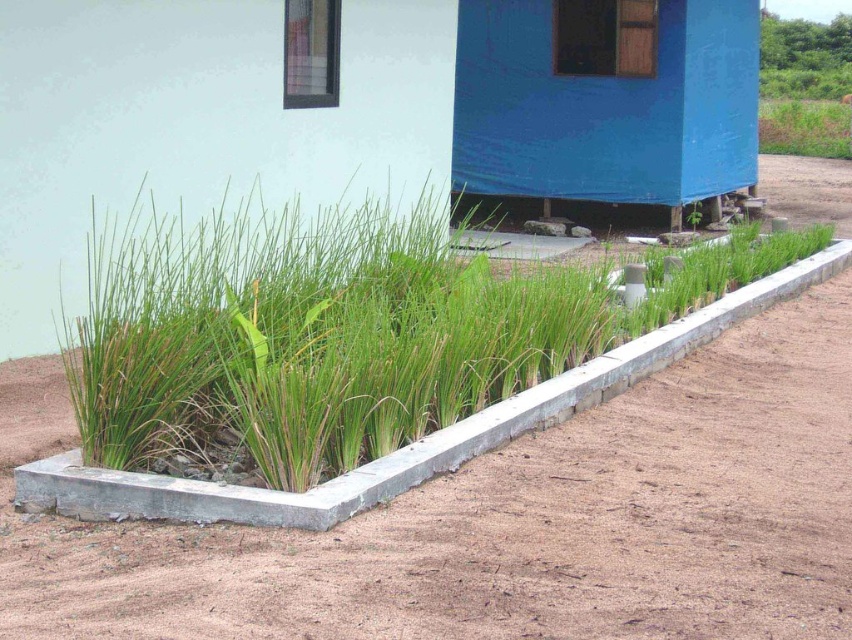
Question: Can you confirm if blue tarpaulin hut at center is smaller than brown soil at lower left?

Choices:
 (A) no
 (B) yes

Answer: (A)

Question: Which of the following is the farthest from the observer?

Choices:
 (A) (487, 58)
 (B) (396, 323)
 (C) (755, 346)

Answer: (A)

Question: Is blue tarpaulin hut at center below green grass at center?

Choices:
 (A) yes
 (B) no

Answer: (B)

Question: Based on their relative distances, which object is nearer to the blue tarpaulin hut at center?

Choices:
 (A) green grass at center
 (B) brown soil at lower left

Answer: (A)

Question: Which point is farther to the camera?

Choices:
 (A) tap(507, 92)
 (B) tap(784, 580)

Answer: (A)

Question: Can you confirm if blue tarpaulin hut at center is positioned above green grass at center?

Choices:
 (A) no
 (B) yes

Answer: (B)